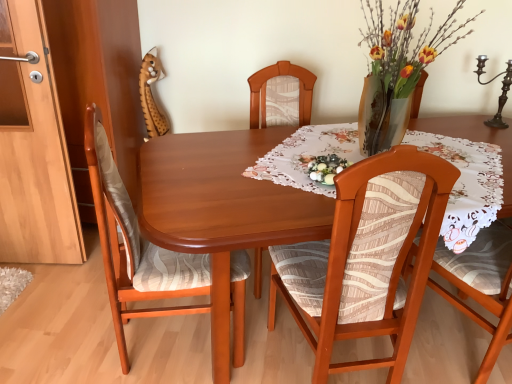
Question: From the image's perspective, does wooden chair at left, arranged as the first chair when viewed from the left, appear higher than matte wood cabinet at left?

Choices:
 (A) no
 (B) yes

Answer: (A)

Question: Is wooden chair at left, which is the second chair in right-to-left order, not close to matte wood cabinet at left?

Choices:
 (A) no
 (B) yes

Answer: (A)

Question: Does wooden chair at left, arranged as the first chair when viewed from the left, appear on the right side of matte wood cabinet at left?

Choices:
 (A) no
 (B) yes

Answer: (B)

Question: Considering the relative positions of wooden chair at left, arranged as the first chair when viewed from the left, and matte wood cabinet at left in the image provided, is wooden chair at left, arranged as the first chair when viewed from the left, to the left of matte wood cabinet at left from the viewer's perspective?

Choices:
 (A) no
 (B) yes

Answer: (A)

Question: From a real-world perspective, is wooden chair at left, arranged as the first chair when viewed from the left, positioned under matte wood cabinet at left based on gravity?

Choices:
 (A) no
 (B) yes

Answer: (B)

Question: Does point (230, 301) appear closer or farther from the camera than point (490, 120)?

Choices:
 (A) farther
 (B) closer

Answer: (B)

Question: Based on their positions, is wooden chair at left, which is the second chair in right-to-left order, located to the left or right of polished dark brown candle holder at upper right?

Choices:
 (A) left
 (B) right

Answer: (A)

Question: Relative to polished dark brown candle holder at upper right, is wooden chair at left, which is the second chair in right-to-left order, in front or behind?

Choices:
 (A) front
 (B) behind

Answer: (A)

Question: Considering the positions of wooden chair at left, which is the second chair in right-to-left order, and polished dark brown candle holder at upper right in the image, is wooden chair at left, which is the second chair in right-to-left order, wider or thinner than polished dark brown candle holder at upper right?

Choices:
 (A) wide
 (B) thin

Answer: (A)

Question: From a real-world perspective, is matte wood cabinet at left positioned above or below wooden chair at left, arranged as the first chair when viewed from the left?

Choices:
 (A) below
 (B) above

Answer: (B)

Question: Relative to wooden chair at left, which is the second chair in right-to-left order, is matte wood cabinet at left in front or behind?

Choices:
 (A) front
 (B) behind

Answer: (B)

Question: From the image's perspective, relative to wooden chair at left, which is the second chair in right-to-left order, is matte wood cabinet at left above or below?

Choices:
 (A) below
 (B) above

Answer: (B)

Question: Based on their positions, is matte wood cabinet at left located to the left or right of wooden chair at left, arranged as the first chair when viewed from the left?

Choices:
 (A) right
 (B) left

Answer: (B)

Question: Do you think wooden chair with patterned fabric at center, positioned as the 1th chair in right-to-left order, is within floral lace tablecloth at center, or outside of it?

Choices:
 (A) inside
 (B) outside

Answer: (B)

Question: From a real-world perspective, is wooden chair with patterned fabric at center, which is counted as the second chair, starting from the left, positioned above or below floral lace tablecloth at center?

Choices:
 (A) below
 (B) above

Answer: (A)